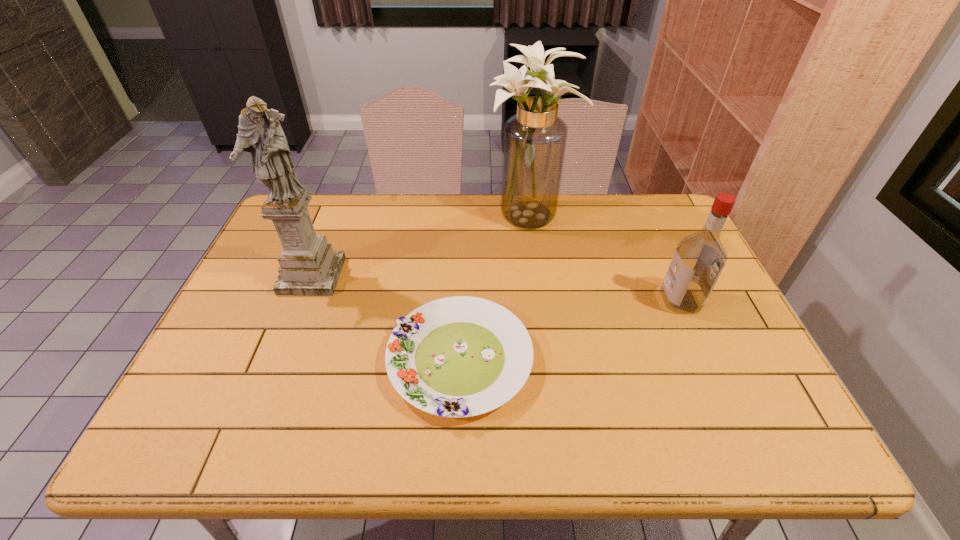
At what (x,y) coordinates should I click in order to perform the action: click on vacant region located 0.180m on the left of the salad plate. Please return your answer as a coordinate pair (x, y). The image size is (960, 540). Looking at the image, I should click on (313, 360).

What are the coordinates of `object at the far edge` in the screenshot? It's located at (534, 141).

At what (x,y) coordinates should I click in order to perform the action: click on object located at the near edge. Please return your answer as a coordinate pair (x, y). Looking at the image, I should click on (461, 356).

Image resolution: width=960 pixels, height=540 pixels. In order to click on object located at the left edge in this screenshot , I will do point(308,265).

Find the location of `object at the right edge`. object at the right edge is located at coordinates coord(699,258).

The height and width of the screenshot is (540, 960). In order to click on vacant space at the far edge of the desktop in this screenshot , I will do `click(500, 203)`.

Find the location of a particular element. The width and height of the screenshot is (960, 540). free region at the near edge of the desktop is located at coordinates (624, 418).

Where is `vacant space at the right edge of the desktop`? Image resolution: width=960 pixels, height=540 pixels. vacant space at the right edge of the desktop is located at coordinates (660, 273).

Image resolution: width=960 pixels, height=540 pixels. What are the coordinates of `vacant space at the near left corner` in the screenshot? It's located at (212, 442).

Where is `vacant space at the far right corner of the desktop`? The width and height of the screenshot is (960, 540). vacant space at the far right corner of the desktop is located at coordinates (648, 198).